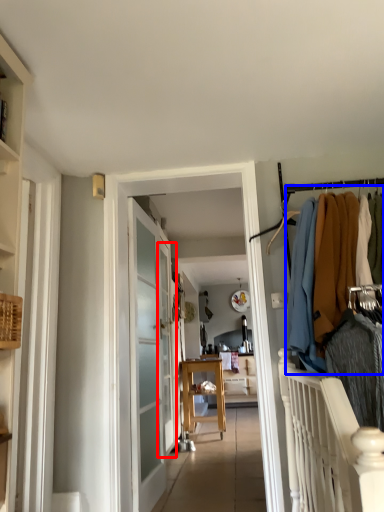
Question: Which of the following is the closest to the observer, screen door (highlighted by a red box) or clothing (highlighted by a blue box)?

Choices:
 (A) screen door
 (B) clothing

Answer: (B)